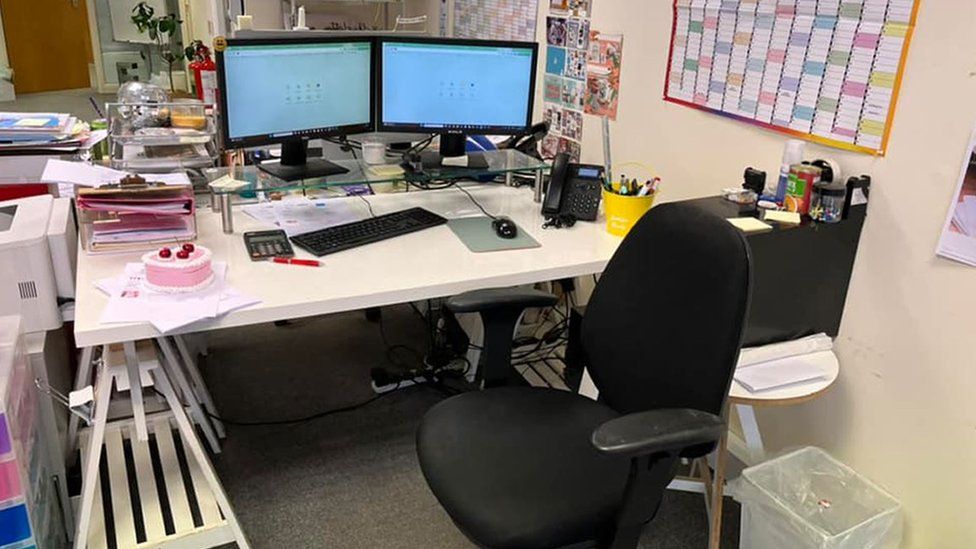
Where is `fire extinguisher`? The height and width of the screenshot is (549, 976). fire extinguisher is located at coordinates [x=202, y=66].